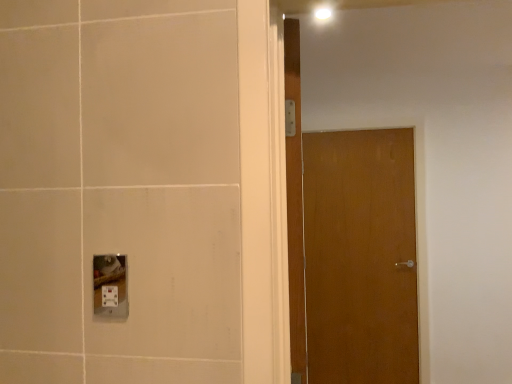
The width and height of the screenshot is (512, 384). I want to click on wooden door at center, the 1th door when ordered from left to right, so click(x=295, y=205).

Between white plastic socket at lower left and wooden door at center, arranged as the first door when viewed from the front, which one appears on the left side from the viewer's perspective?

From the viewer's perspective, white plastic socket at lower left appears more on the left side.

Is white plastic socket at lower left far away from wooden door at center, which ranks as the second door in back-to-front order?

No, white plastic socket at lower left is not far from wooden door at center, which ranks as the second door in back-to-front order.

Considering the sizes of objects white plastic socket at lower left and wooden door at center, the 1th door when ordered from left to right, in the image provided, who is bigger, white plastic socket at lower left or wooden door at center, the 1th door when ordered from left to right,?

wooden door at center, the 1th door when ordered from left to right, is bigger.

Is white plastic socket at lower left aimed at wooden door at center, the 1th door when ordered from left to right?

No, white plastic socket at lower left is not oriented towards wooden door at center, the 1th door when ordered from left to right.

The height and width of the screenshot is (384, 512). I want to click on socket on the left of wooden door at center, which ranks as the second door in back-to-front order, so click(110, 286).

Does wooden door at center, arranged as the first door when viewed from the front, touch white plastic socket at lower left?

wooden door at center, arranged as the first door when viewed from the front, is not next to white plastic socket at lower left, and they're not touching.

From a real-world perspective, which object stands above the other?

wooden door at center, the 1th door when ordered from left to right, is physically above.

In the scene shown: Is wooden door at center, which ranks as the second door in back-to-front order, spatially inside white plastic socket at lower left, or outside of it?

wooden door at center, which ranks as the second door in back-to-front order, is not enclosed by white plastic socket at lower left.

In the scene shown: Does white plastic socket at lower left lie in front of wooden door at center, which appears as the 1th door when viewed from the back?

That is True.

Is white plastic socket at lower left surrounding wooden door at center, which is the second door from front to back?

No, wooden door at center, which is the second door from front to back, is not inside white plastic socket at lower left.

Can you confirm if white plastic socket at lower left is positioned to the right of wooden door at center, marked as the first door in a right-to-left arrangement?

Incorrect, white plastic socket at lower left is not on the right side of wooden door at center, marked as the first door in a right-to-left arrangement.

Can you tell me how much white plastic socket at lower left and wooden door at center, marked as the first door in a right-to-left arrangement, differ in facing direction?

2.38 degrees.

Which is farther from the camera, (365, 260) or (295, 349)?

The point (365, 260) is more distant.

Considering the sizes of objects wooden door at center, which is the second door from front to back, and wooden door at center, arranged as the first door when viewed from the front, in the image provided, who is taller, wooden door at center, which is the second door from front to back, or wooden door at center, arranged as the first door when viewed from the front,?

With more height is wooden door at center, which is the second door from front to back.

Considering their positions, is wooden door at center, which is the second door from front to back, located in front of or behind wooden door at center, which ranks as the second door in back-to-front order?

wooden door at center, which is the second door from front to back, is behind wooden door at center, which ranks as the second door in back-to-front order.

Would you say wooden door at center, the second door viewed from the left, is to the left or to the right of wooden door at center, placed as the second door when sorted from right to left, in the picture?

wooden door at center, the second door viewed from the left, is to the right of wooden door at center, placed as the second door when sorted from right to left.

Is wooden door at center, placed as the second door when sorted from right to left, situated inside wooden door at center, which is the second door from front to back, or outside?

wooden door at center, placed as the second door when sorted from right to left, exists outside the volume of wooden door at center, which is the second door from front to back.

Is wooden door at center, which ranks as the second door in back-to-front order, taller than wooden door at center, which is the second door from front to back?

No, wooden door at center, which ranks as the second door in back-to-front order, is not taller than wooden door at center, which is the second door from front to back.

Does wooden door at center, which ranks as the second door in back-to-front order, have a lesser width compared to wooden door at center, which is the second door from front to back?

No, wooden door at center, which ranks as the second door in back-to-front order, is not thinner than wooden door at center, which is the second door from front to back.

Would you say wooden door at center, marked as the first door in a right-to-left arrangement, is inside or outside white plastic socket at lower left?

wooden door at center, marked as the first door in a right-to-left arrangement, exists outside the volume of white plastic socket at lower left.

Where is `socket above the wooden door at center, the second door viewed from the left (from the image's perspective)`? socket above the wooden door at center, the second door viewed from the left (from the image's perspective) is located at coordinates (110, 286).

From the image's perspective, which object appears higher, wooden door at center, which is the second door from front to back, or white plastic socket at lower left?

white plastic socket at lower left.

What's the angular difference between wooden door at center, marked as the first door in a right-to-left arrangement, and white plastic socket at lower left's facing directions?

2.38 degrees.

Image resolution: width=512 pixels, height=384 pixels. I want to click on socket that is in front of the wooden door at center, the 1th door when ordered from left to right, so click(x=110, y=286).

In order to click on socket on the left of wooden door at center, arranged as the first door when viewed from the front in this screenshot , I will do `click(110, 286)`.

From the image, which object appears to be nearer to wooden door at center, the second door viewed from the left, white plastic socket at lower left or wooden door at center, the 1th door when ordered from left to right?

Based on the image, wooden door at center, the 1th door when ordered from left to right, appears to be nearer to wooden door at center, the second door viewed from the left.

Based on their spatial positions, is wooden door at center, marked as the first door in a right-to-left arrangement, or white plastic socket at lower left further from wooden door at center, placed as the second door when sorted from right to left?

wooden door at center, marked as the first door in a right-to-left arrangement, lies further to wooden door at center, placed as the second door when sorted from right to left, than the other object.

Based on their spatial positions, is wooden door at center, arranged as the first door when viewed from the front, or wooden door at center, the second door viewed from the left, closer to white plastic socket at lower left?

wooden door at center, arranged as the first door when viewed from the front, is positioned closer to the anchor white plastic socket at lower left.

From the image, which object appears to be farther from wooden door at center, arranged as the first door when viewed from the front, white plastic socket at lower left or wooden door at center, which is the second door from front to back?

Among the two, wooden door at center, which is the second door from front to back, is located further to wooden door at center, arranged as the first door when viewed from the front.

Which object lies nearer to the anchor point wooden door at center, the second door viewed from the left, wooden door at center, arranged as the first door when viewed from the front, or white plastic socket at lower left?

Based on the image, wooden door at center, arranged as the first door when viewed from the front, appears to be nearer to wooden door at center, the second door viewed from the left.

Based on their spatial positions, is wooden door at center, the second door viewed from the left, or wooden door at center, placed as the second door when sorted from right to left, further from white plastic socket at lower left?

wooden door at center, the second door viewed from the left, lies further to white plastic socket at lower left than the other object.

I want to click on door located between white plastic socket at lower left and wooden door at center, which appears as the 1th door when viewed from the back, in the depth direction, so click(295, 205).